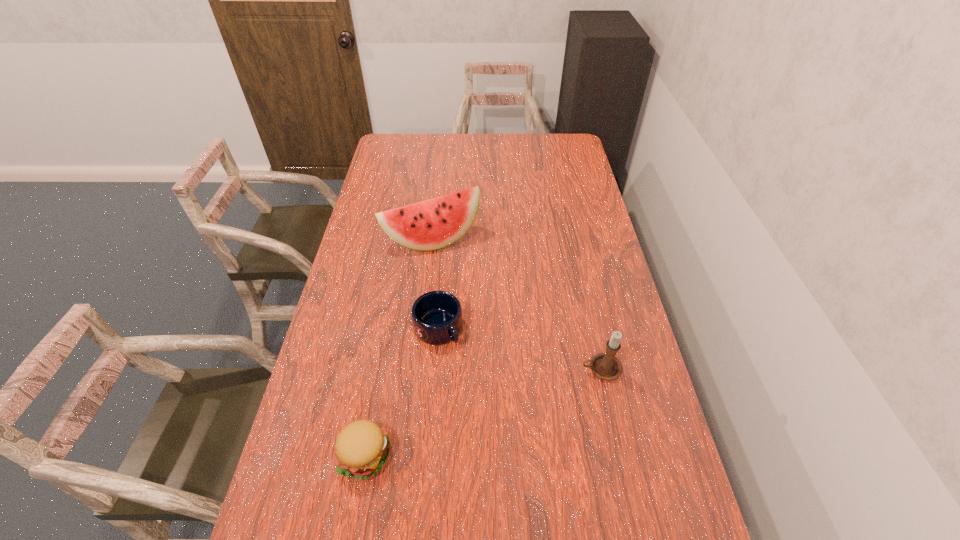
Locate an element on the screen. This screenshot has height=540, width=960. free spot between the watermelon and the third nearest object is located at coordinates (435, 284).

Where is `free spot between the candle holder and the tallest object`? The image size is (960, 540). free spot between the candle holder and the tallest object is located at coordinates (516, 304).

At what (x,y) coordinates should I click in order to perform the action: click on free space between the second tallest object and the third nearest object. Please return your answer as a coordinate pair (x, y). Image resolution: width=960 pixels, height=540 pixels. Looking at the image, I should click on (519, 349).

Identify the location of free point between the candle holder and the watermelon. This screenshot has height=540, width=960. (516, 304).

Where is `the closest object to the mug`? the closest object to the mug is located at coordinates (361, 448).

Identify which object is located as the nearest to the third nearest object. Please provide its 2D coordinates. Your answer should be formatted as a tuple, i.e. [(x, y)], where the tuple contains the x and y coordinates of a point satisfying the conditions above.

[(361, 448)]

Identify the location of free space in the image that satisfies the following two spatial constraints: 1. on the back side of the nearest object; 2. on the right side of the farthest object. (403, 240).

What are the coordinates of `vacant position in the image that satisfies the following two spatial constraints: 1. on the back side of the hamburger; 2. on the side of the rightmost object with the handle` in the screenshot? It's located at (380, 369).

Locate an element on the screen. vacant region that satisfies the following two spatial constraints: 1. on the front side of the second farthest object; 2. on the side of the candle holder with the handle is located at coordinates (435, 369).